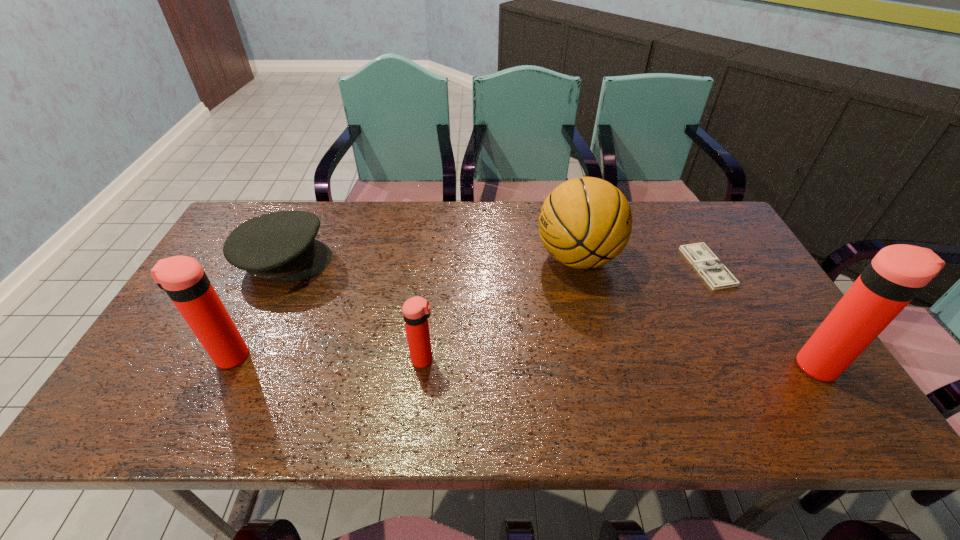
In the image, there is a desktop. Where is `vacant space at the left edge`? vacant space at the left edge is located at coordinates (233, 286).

At what (x,y) coordinates should I click in order to perform the action: click on free space at the right edge of the desktop. Please return your answer as a coordinate pair (x, y). The image size is (960, 540). Looking at the image, I should click on (760, 303).

The image size is (960, 540). I want to click on free space at the near left corner, so click(139, 383).

This screenshot has width=960, height=540. In the image, there is a desktop. In order to click on free space at the far right corner in this screenshot , I will do `click(675, 201)`.

Locate an element on the screen. free point between the fifth tallest object and the fourth object from left to right is located at coordinates (431, 259).

At what (x,y) coordinates should I click in order to perform the action: click on free space between the fourth object from right to left and the dollar. Please return your answer as a coordinate pair (x, y). This screenshot has width=960, height=540. Looking at the image, I should click on (565, 313).

This screenshot has height=540, width=960. Find the location of `vacant area between the leftmost thermos bottle and the beret`. vacant area between the leftmost thermos bottle and the beret is located at coordinates (257, 308).

I want to click on vacant region between the rightmost object and the second shortest object, so click(552, 313).

Where is `free space between the leftmost thermos bottle and the shortest thermos bottle`? The image size is (960, 540). free space between the leftmost thermos bottle and the shortest thermos bottle is located at coordinates (326, 358).

At what (x,y) coordinates should I click in order to perform the action: click on empty space that is in between the second shortest object and the second object from right to left. Please return your answer as a coordinate pair (x, y). The width and height of the screenshot is (960, 540). Looking at the image, I should click on (496, 264).